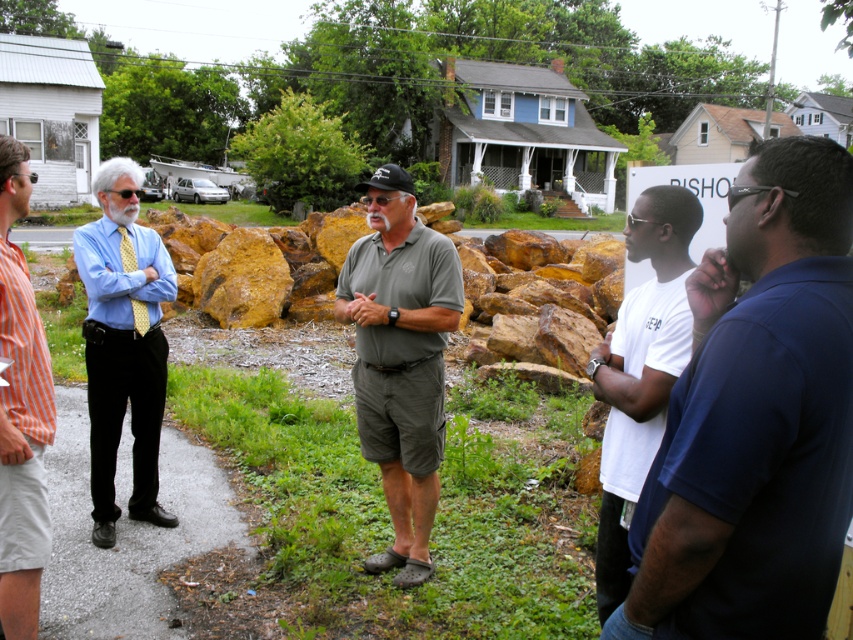
Question: Does dark green fabric shirt at center appear over blue shirt at left?

Choices:
 (A) yes
 (B) no

Answer: (B)

Question: Which point appears farthest from the camera in this image?

Choices:
 (A) (160, 362)
 (B) (666, 259)
 (C) (428, 508)
 (D) (834, 349)

Answer: (A)

Question: Is white cotton t-shirt at right to the left of orange striped shirt at left from the viewer's perspective?

Choices:
 (A) no
 (B) yes

Answer: (A)

Question: Considering the real-world distances, which object is closest to the dark blue shirt at right?

Choices:
 (A) white cotton t-shirt at right
 (B) blue shirt at left
 (C) dark green fabric shirt at center
 (D) orange striped shirt at left

Answer: (A)

Question: Which object is the closest to the orange striped shirt at left?

Choices:
 (A) dark green fabric shirt at center
 (B) white cotton t-shirt at right

Answer: (A)

Question: Does dark blue shirt at right have a larger size compared to orange striped shirt at left?

Choices:
 (A) yes
 (B) no

Answer: (A)